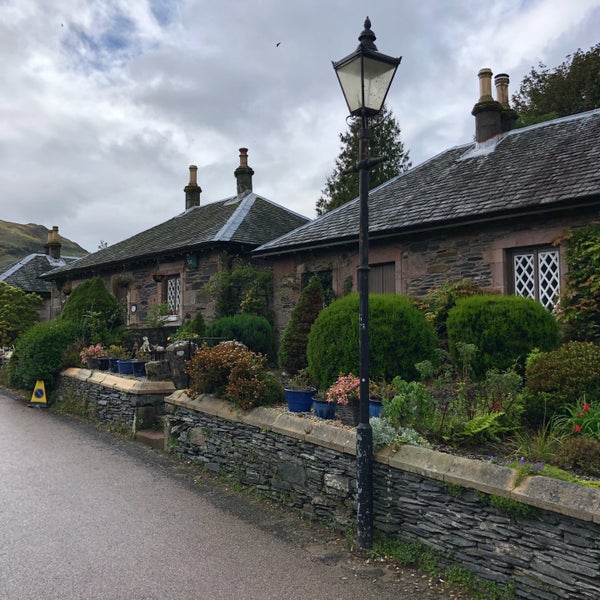
You are a GUI agent. You are given a task and a screenshot of the screen. Output one action in this format:
    pyautogui.click(x=<x>, y=<y>)
    Task: Click on the lamp
    The image size is (600, 600).
    Given the screenshot: What is the action you would take?
    pyautogui.click(x=372, y=90)